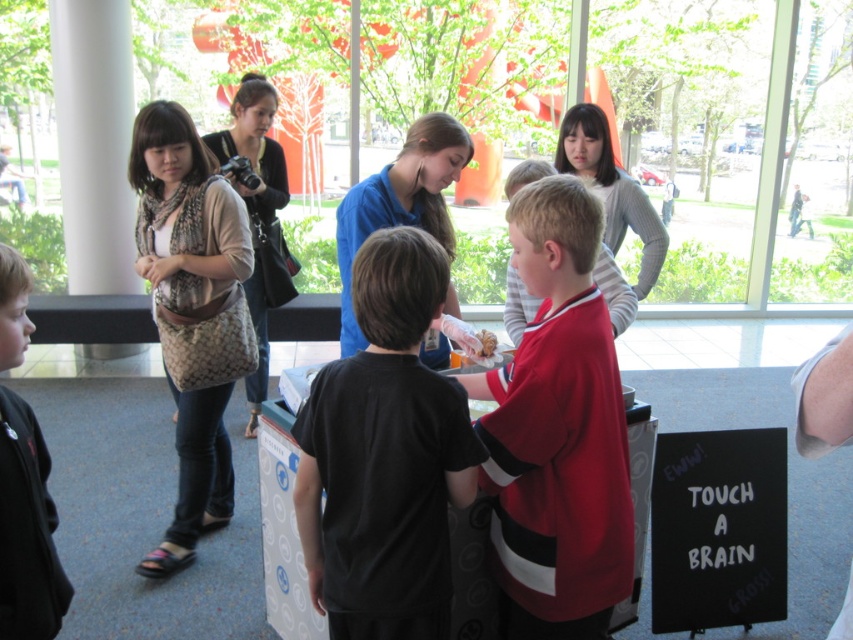
Question: Which point is farther to the camera?

Choices:
 (A) leather handbag at upper left
 (B) black chalkboard at lower right
 (C) blue smooth shirt at center
 (D) matte beige scarf at left

Answer: (A)

Question: Which of the following is the closest to the observer?

Choices:
 (A) (355, 532)
 (B) (273, 90)
 (C) (529, 428)

Answer: (C)

Question: Can you confirm if dark gray sweater at lower left is positioned to the left of blue smooth shirt at center?

Choices:
 (A) yes
 (B) no

Answer: (A)

Question: Estimate the real-world distances between objects in this image. Which object is farther from the blue smooth shirt at center?

Choices:
 (A) black chalkboard at lower right
 (B) red matte jersey at center
 (C) spongy white brain at center
 (D) black matte shirt at center

Answer: (A)

Question: Does dark gray sweater at lower left appear over spongy white brain at center?

Choices:
 (A) no
 (B) yes

Answer: (A)

Question: Is black matte shirt at center positioned before dark gray sweater at lower left?

Choices:
 (A) yes
 (B) no

Answer: (B)